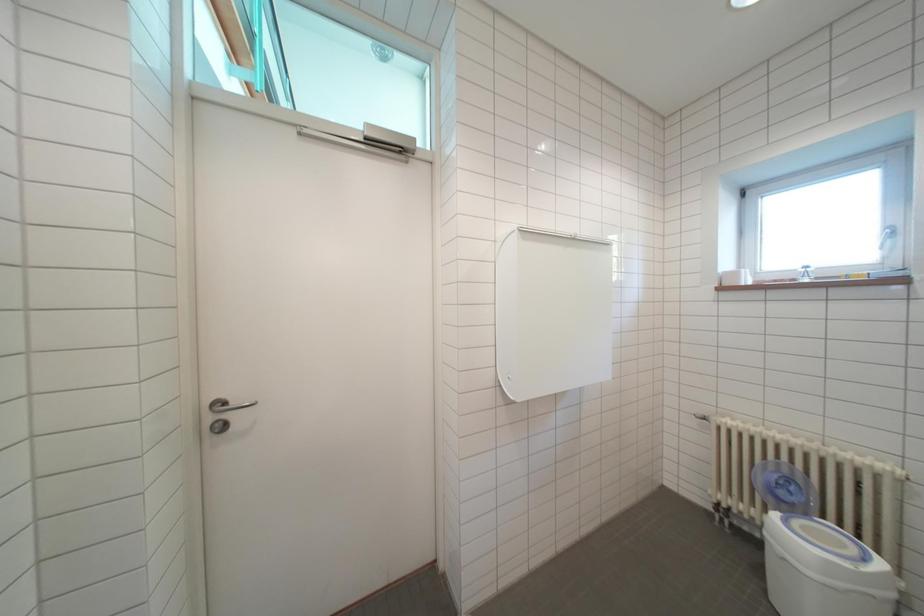
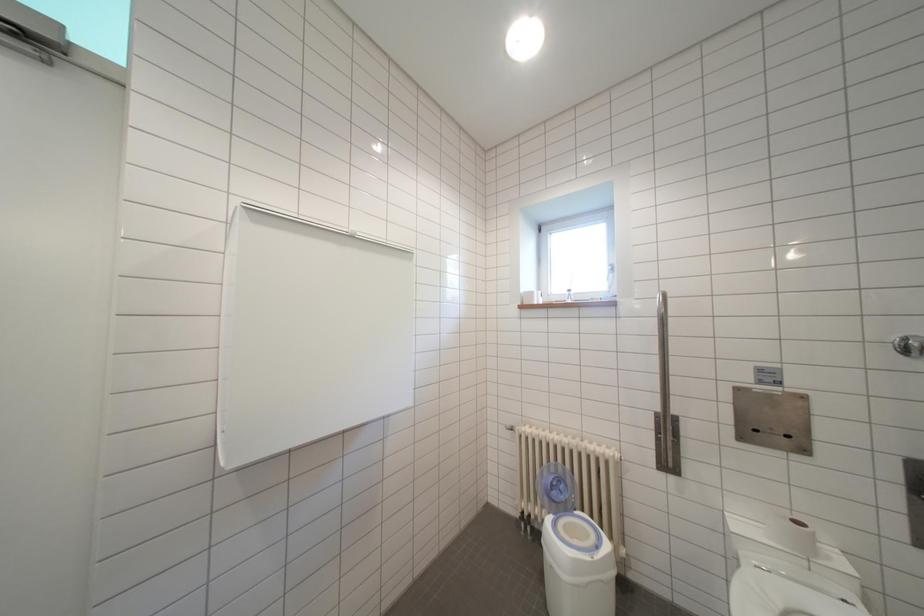
Question: How did the camera likely rotate?

Choices:
 (A) Left
 (B) Right
 (C) Up
 (D) Down

Answer: (B)